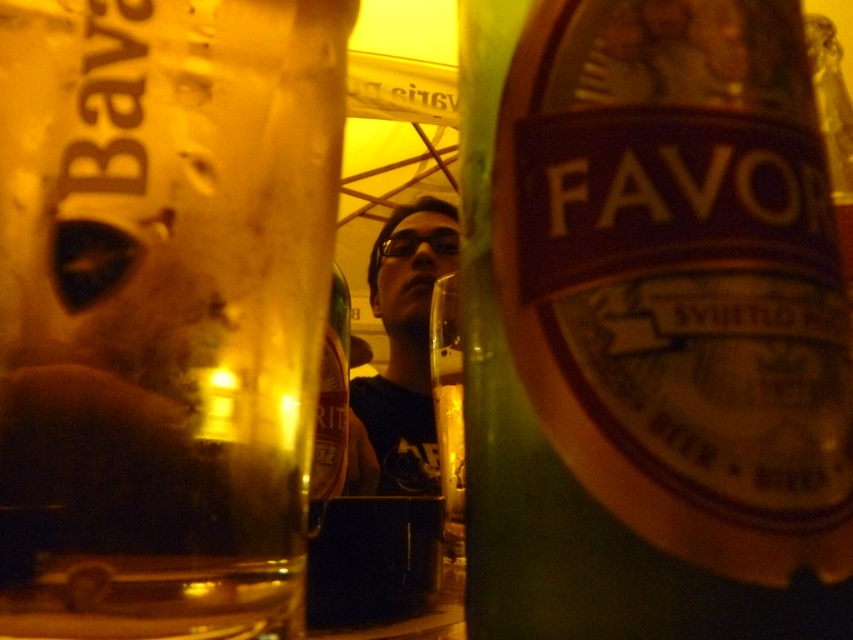
Does translucent amber glass at left have a greater width compared to shiny gold bottle at center?

Yes.

Measure the distance between point (254, 369) and camera.

13.24 centimeters

What are the coordinates of `translucent amber glass at left` in the screenshot? It's located at (161, 307).

Can you confirm if translucent amber glass at left is shorter than matte black shirt at center?

Correct, translucent amber glass at left is not as tall as matte black shirt at center.

Does translucent amber glass at left have a lesser width compared to matte black shirt at center?

Indeed, translucent amber glass at left has a lesser width compared to matte black shirt at center.

Is point (160, 394) positioned in front of point (384, 298)?

Yes, it is in front of point (384, 298).

Where is `translucent amber glass at left`? This screenshot has height=640, width=853. translucent amber glass at left is located at coordinates (161, 307).

Can you confirm if green glass bottle at center right is taller than shiny gold bottle at center?

In fact, green glass bottle at center right may be shorter than shiny gold bottle at center.

Based on the photo, which is more to the right, green glass bottle at center right or shiny gold bottle at center?

From the viewer's perspective, green glass bottle at center right appears more on the right side.

Does point (473, 145) come closer to viewer compared to point (323, 420)?

Yes, point (473, 145) is closer to viewer.

Find the location of a particular element. green glass bottle at center right is located at coordinates (561, 465).